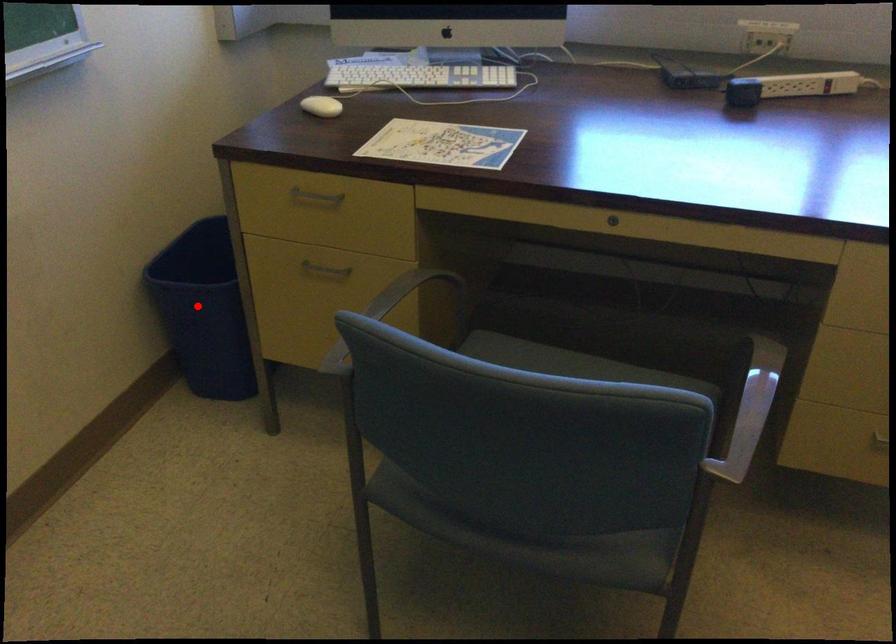
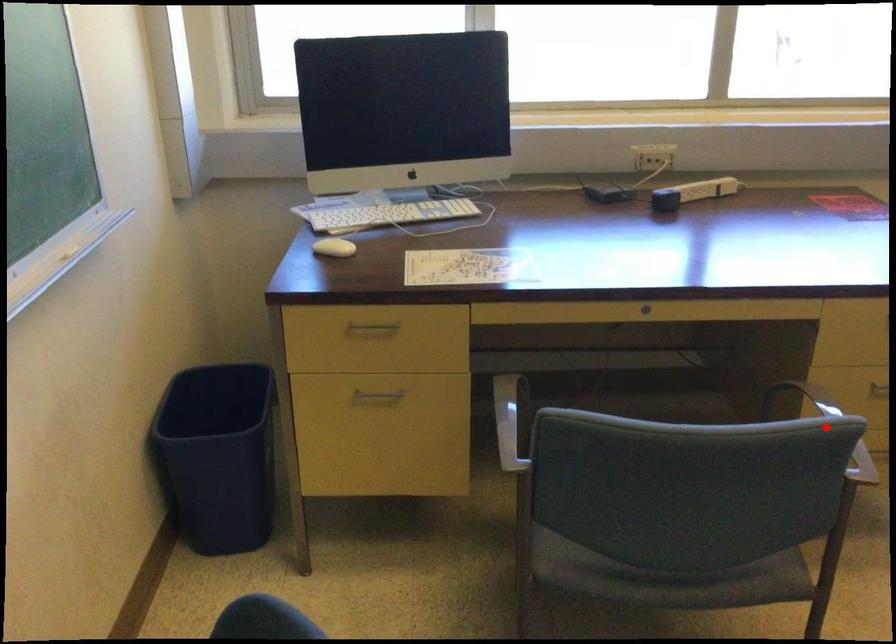
I am providing you with two images of the same scene from different viewpoints. A red point is marked on the first image and another point is marked on the second image. Is the marked point in image1 the same physical position as the marked point in image2?

No